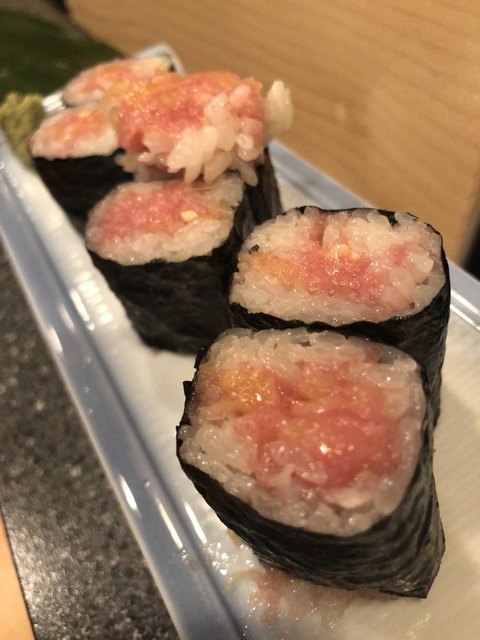
The height and width of the screenshot is (640, 480). What are the coordinates of `countertop` in the screenshot? It's located at (91, 568).